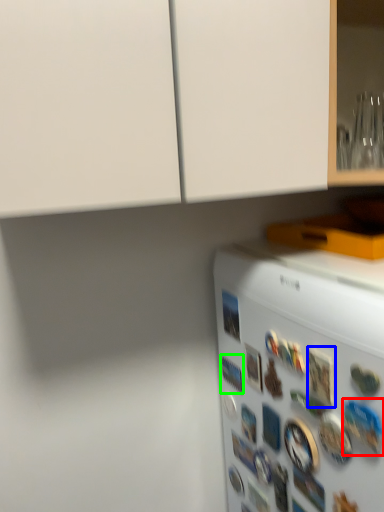
Question: Which object is positioned farthest from button (highlighted by a red box)? Select from button (highlighted by a blue box) and button (highlighted by a green box).

Choices:
 (A) button
 (B) button

Answer: (B)